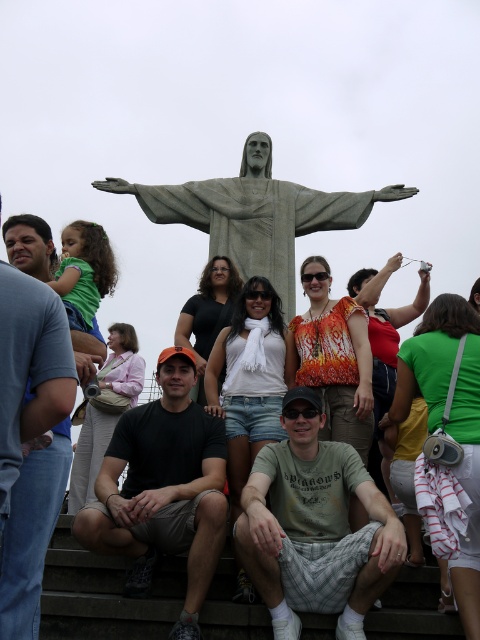
Where is the gray stone statue at center located in the image?

The gray stone statue at center is located at point (255, 212) in the image.

You are standing at the base of the Christ the Redeemer statue and want to take a photo of two specific points in the scene. The first point is at coordinates point (337, 202) and the second is at point (377, 344). If you are facing the statue, which point will appear closer to you in the photo?

Point (377, 344) will appear closer to you in the photo because it is in front of point (337, 202) according to their positions.

You are a photographer trying to capture a photo of the gray stone statue at center and the orange printed blouse at center. Based on their sizes in the image, which object appears larger?

The orange printed blouse at center appears larger because it is taller than the gray stone statue at center.